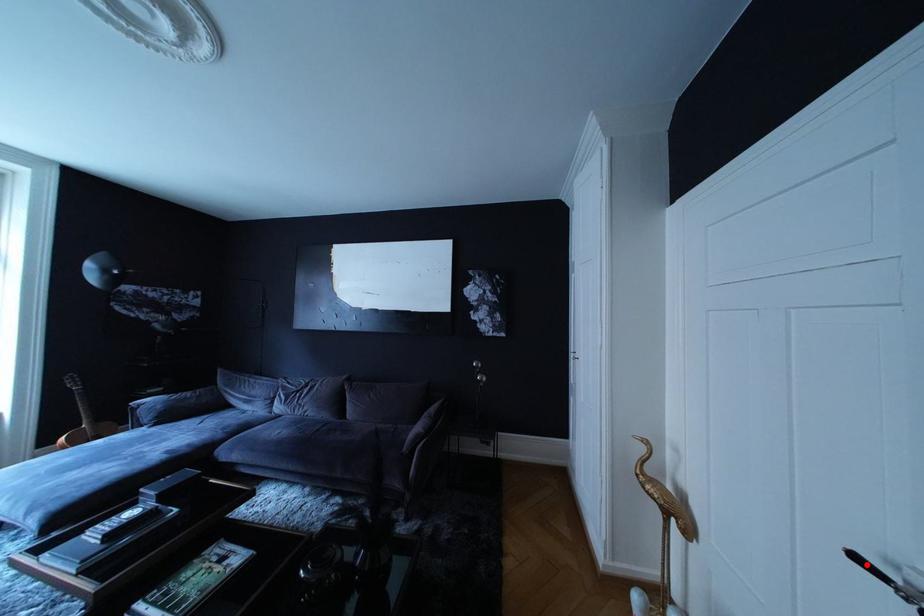
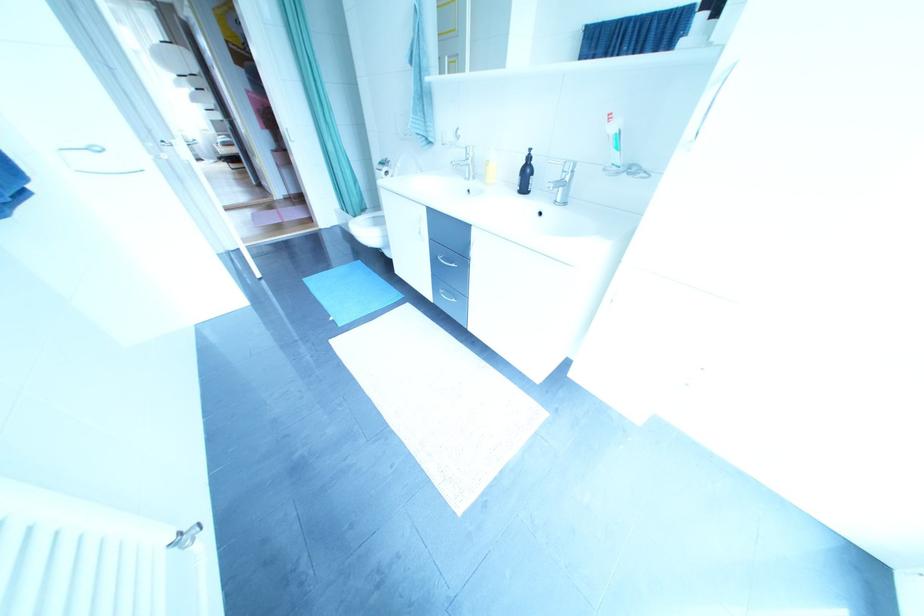
Question: I am providing you with two images of the same scene from different viewpoints. A red point is marked on the first image. Can you still see the location of the red point in image 2?

Choices:
 (A) Yes
 (B) No

Answer: (B)